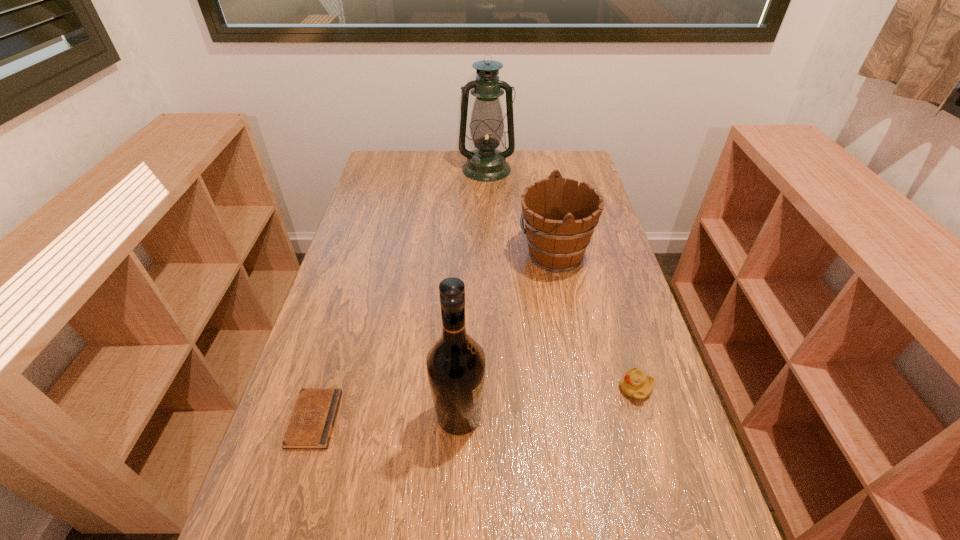
Where is `vacant space at the left edge of the desktop`? The height and width of the screenshot is (540, 960). vacant space at the left edge of the desktop is located at coordinates (375, 276).

You are a GUI agent. You are given a task and a screenshot of the screen. Output one action in this format:
    pyautogui.click(x=<x>, y=<y>)
    Task: Click on the vacant space at the right edge of the desktop
    The image size is (960, 540).
    Given the screenshot: What is the action you would take?
    pyautogui.click(x=620, y=306)

Identify the location of vacant region at the far left corner of the desktop. This screenshot has width=960, height=540. (372, 178).

The image size is (960, 540). Find the location of `free space between the oil lamp and the leftmost object`. free space between the oil lamp and the leftmost object is located at coordinates (400, 294).

Image resolution: width=960 pixels, height=540 pixels. I want to click on free space between the third tallest object and the leftmost object, so click(434, 336).

You are a GUI agent. You are given a task and a screenshot of the screen. Output one action in this format:
    pyautogui.click(x=<x>, y=<y>)
    Task: Click on the unoccupied position between the wine bottle and the leftmost object
    The height and width of the screenshot is (540, 960).
    Given the screenshot: What is the action you would take?
    pyautogui.click(x=387, y=417)

Where is `blank region between the fourth tallest object and the fourth nearest object`? This screenshot has width=960, height=540. blank region between the fourth tallest object and the fourth nearest object is located at coordinates (595, 321).

In order to click on free space between the wine bottle and the fourth tallest object in this screenshot , I will do `click(547, 402)`.

This screenshot has width=960, height=540. Find the location of `vacant space that's between the oil lamp and the shortest object`. vacant space that's between the oil lamp and the shortest object is located at coordinates (400, 294).

What are the coordinates of `unoccupied area between the wine bottle and the wine bucket` in the screenshot? It's located at (507, 335).